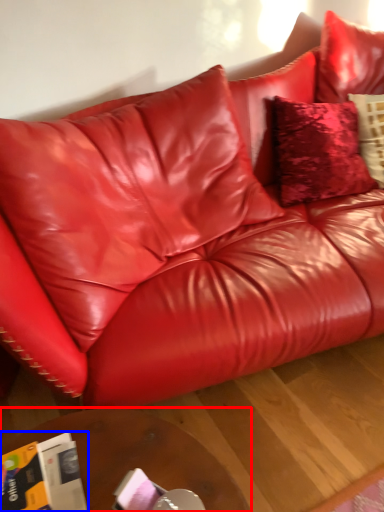
Question: Which of the following is the farthest to the observer, table (highlighted by a red box) or magazine (highlighted by a blue box)?

Choices:
 (A) table
 (B) magazine

Answer: (A)